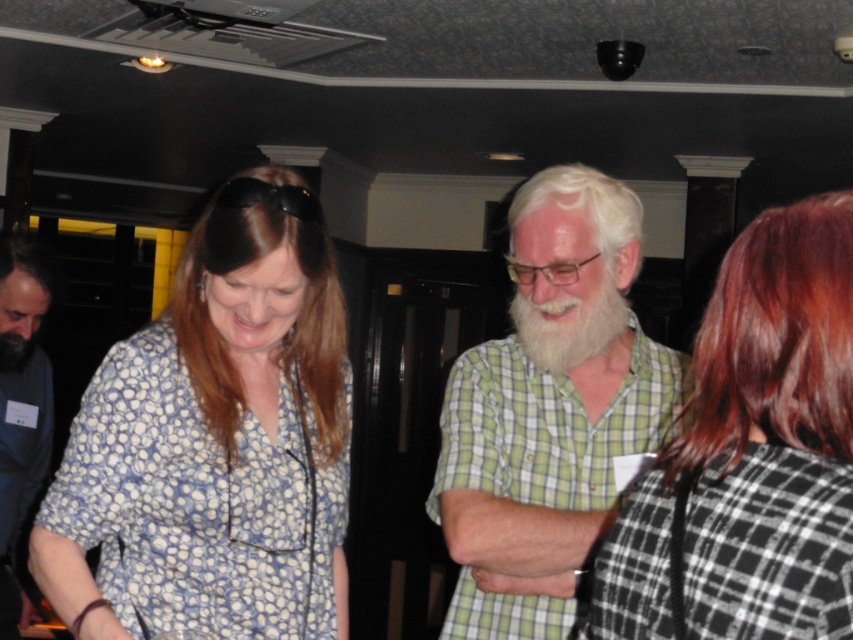
Question: Is green checkered shirt at center thinner than dark brown hair at upper left?

Choices:
 (A) yes
 (B) no

Answer: (B)

Question: Which of these objects is positioned farthest from the dark blue shirt at left?

Choices:
 (A) black fuzzy beard at lower left
 (B) black and white checkered shirt at upper right
 (C) white matte hair at center
 (D) brown smooth hair at center

Answer: (B)

Question: Which object appears farthest from the camera in this image?

Choices:
 (A) dark blue shirt at left
 (B) blue dotted shirt at left

Answer: (A)

Question: Is brown smooth hair at center wider than whitehairbeard at center?

Choices:
 (A) no
 (B) yes

Answer: (B)

Question: Which point is farther to the camera?

Choices:
 (A) (0, 356)
 (B) (183, 266)
 (C) (48, 288)
 (D) (726, 419)

Answer: (C)

Question: Can you confirm if blue dotted shirt at left is positioned to the left of dark blue shirt at left?

Choices:
 (A) no
 (B) yes

Answer: (A)